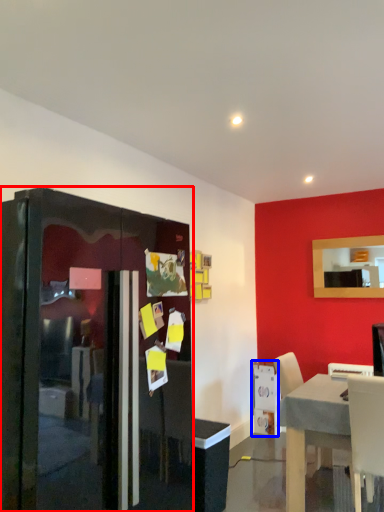
Question: Among these objects, which one is farthest to the camera, fridge (highlighted by a red box) or appliance (highlighted by a blue box)?

Choices:
 (A) fridge
 (B) appliance

Answer: (B)